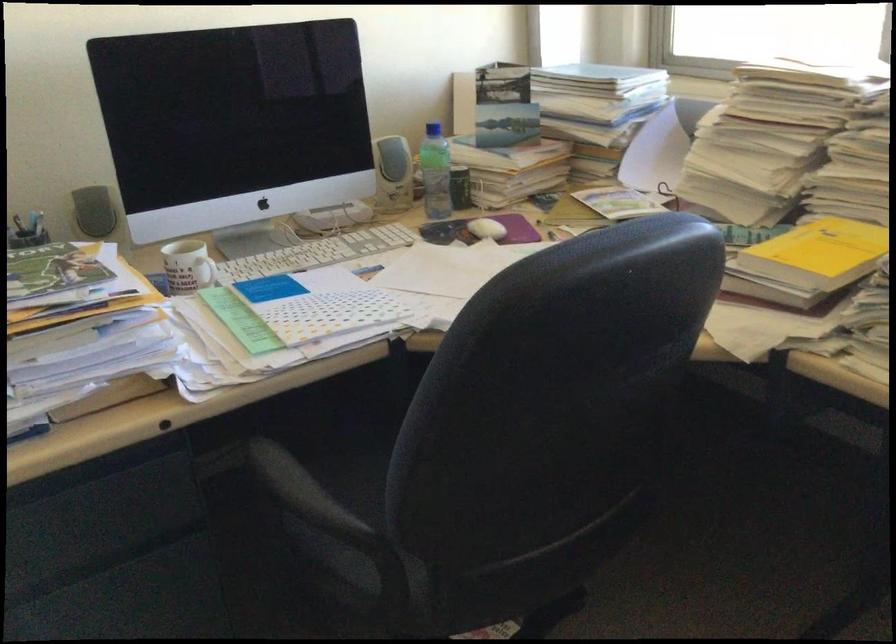
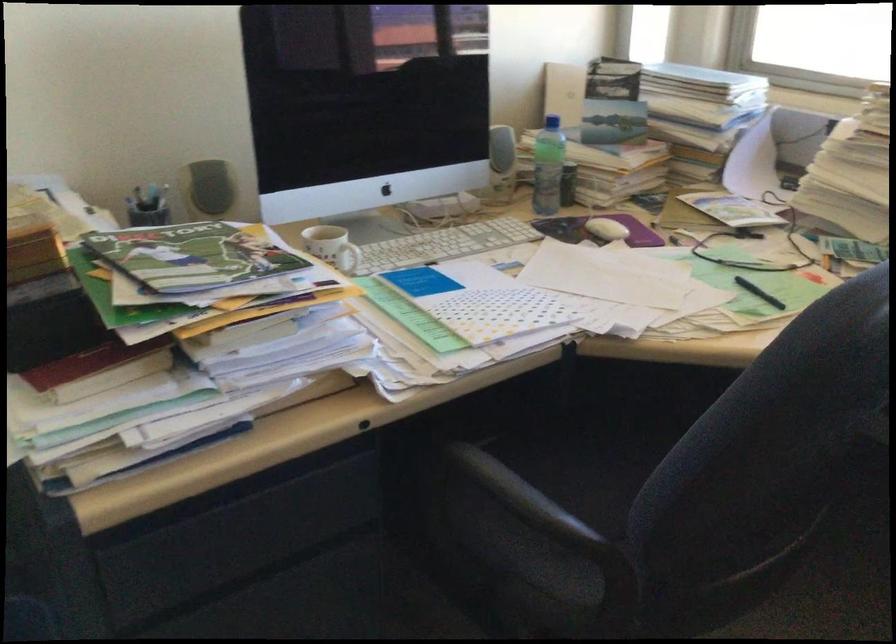
Question: The camera is either moving clockwise (left) or counter-clockwise (right) around the object. The first image is from the beginning of the video and the second image is from the end. Is the camera moving left or right when shooting the video?

Choices:
 (A) Left
 (B) Right

Answer: (A)